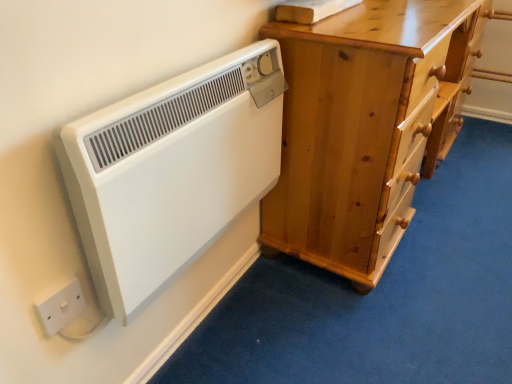
Question: Considering the positions of white plastic radiator at left and white plastic electric outlet at lower left in the image, is white plastic radiator at left bigger or smaller than white plastic electric outlet at lower left?

Choices:
 (A) small
 (B) big

Answer: (B)

Question: Relative to white plastic electric outlet at lower left, is white plastic radiator at left in front or behind?

Choices:
 (A) behind
 (B) front

Answer: (B)

Question: Which is farther from the light brown wooden chest of drawers at right?

Choices:
 (A) white plastic electric outlet at lower left
 (B) white plastic radiator at left

Answer: (A)

Question: Considering the real-world distances, which object is closest to the light brown wooden chest of drawers at right?

Choices:
 (A) white plastic radiator at left
 (B) white plastic electric outlet at lower left

Answer: (A)